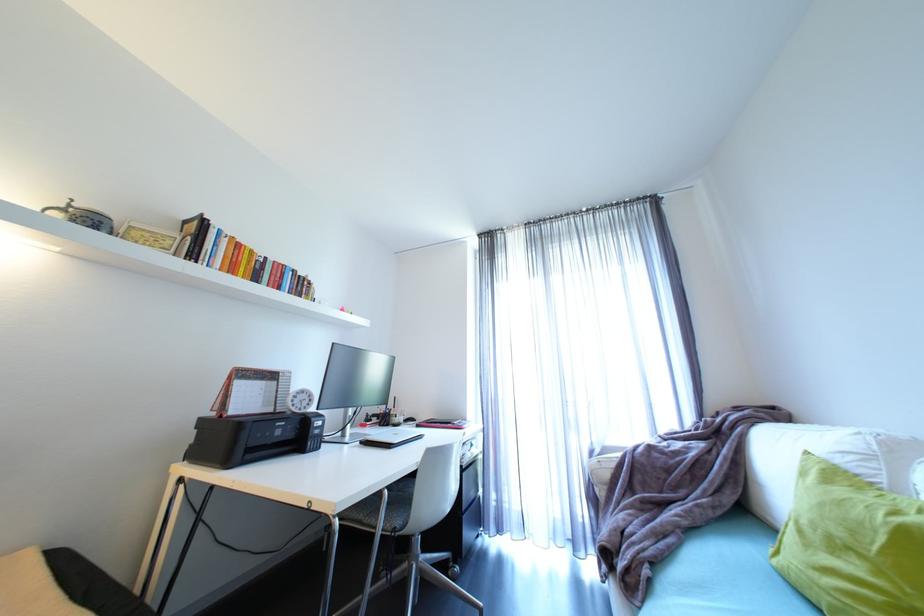
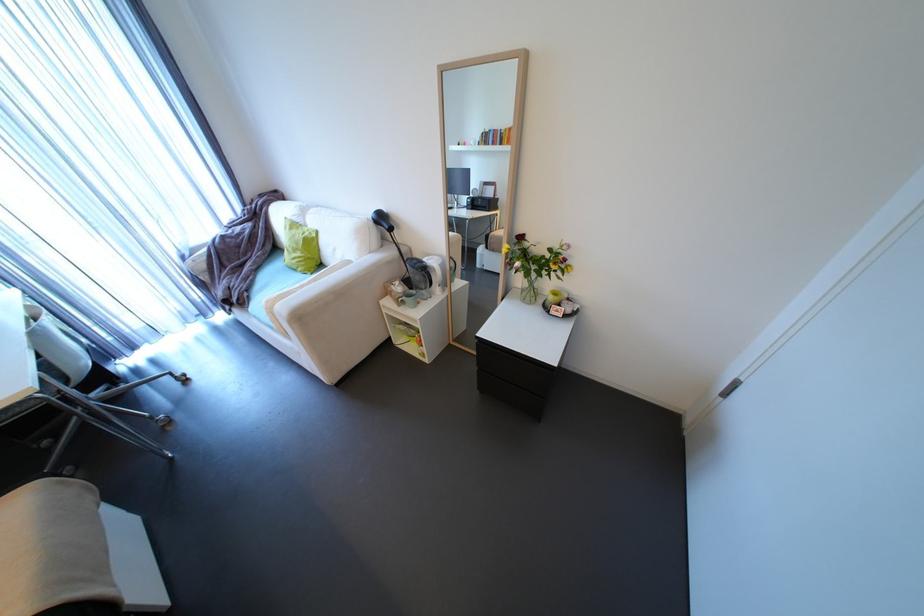
Where in the second image is the point corresponding to pixel 885 573 from the first image?

(310, 253)